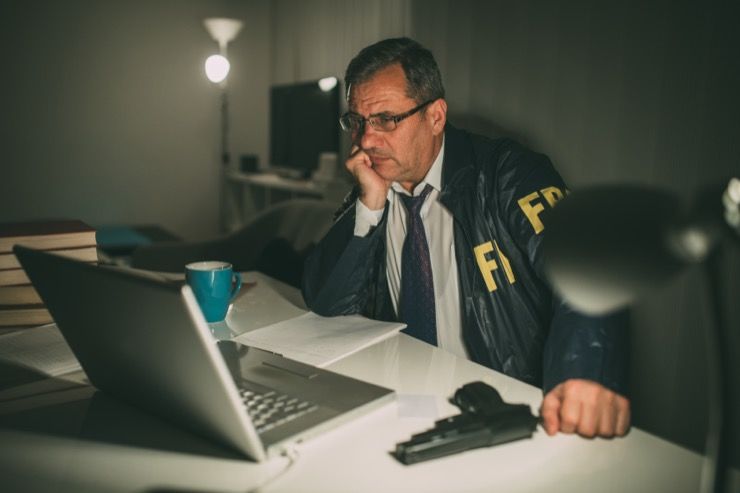
Locate an element on the screen. This screenshot has width=740, height=493. trackpad on laptop is located at coordinates (277, 379).